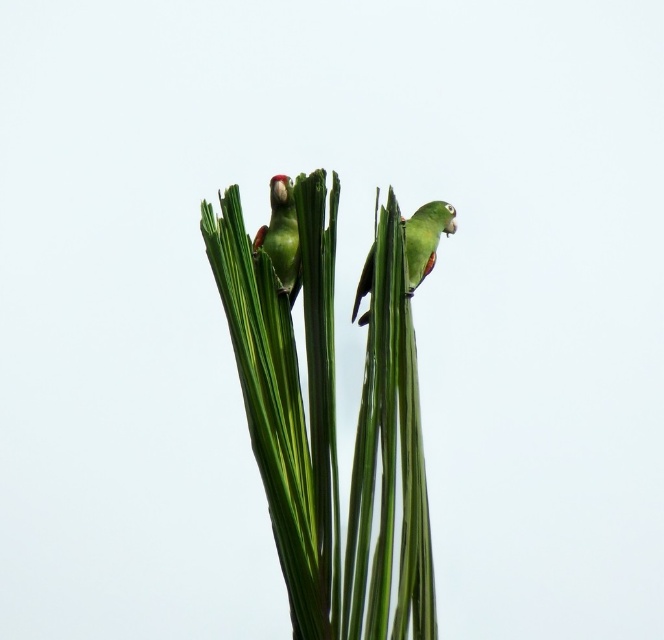
Question: Which is farther from the green matte parrot at center?

Choices:
 (A) green matte parrot at upper center
 (B) green leafy plant at center

Answer: (B)

Question: Is green matte parrot at upper center positioned before green matte parrot at center?

Choices:
 (A) no
 (B) yes

Answer: (B)

Question: Is green matte parrot at upper center positioned in front of green matte parrot at center?

Choices:
 (A) no
 (B) yes

Answer: (B)

Question: Which is farther from the green matte parrot at upper center?

Choices:
 (A) green matte parrot at center
 (B) green leafy plant at center

Answer: (A)

Question: Is green leafy plant at center thinner than green matte parrot at center?

Choices:
 (A) no
 (B) yes

Answer: (A)

Question: Estimate the real-world distances between objects in this image. Which object is closer to the green matte parrot at upper center?

Choices:
 (A) green matte parrot at center
 (B) green leafy plant at center

Answer: (B)